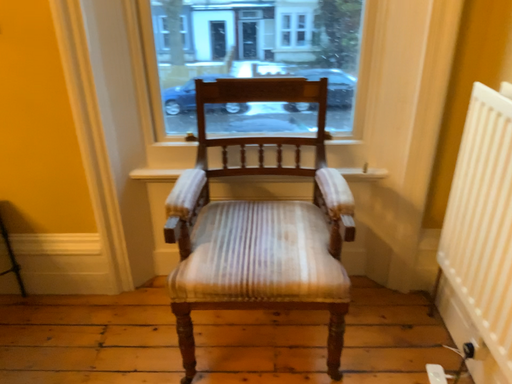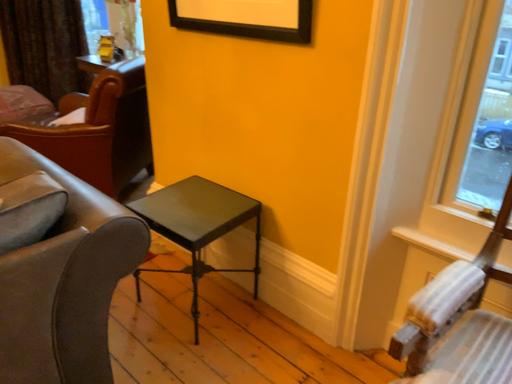
Question: How did the camera likely rotate when shooting the video?

Choices:
 (A) rotated upward
 (B) rotated downward

Answer: (A)